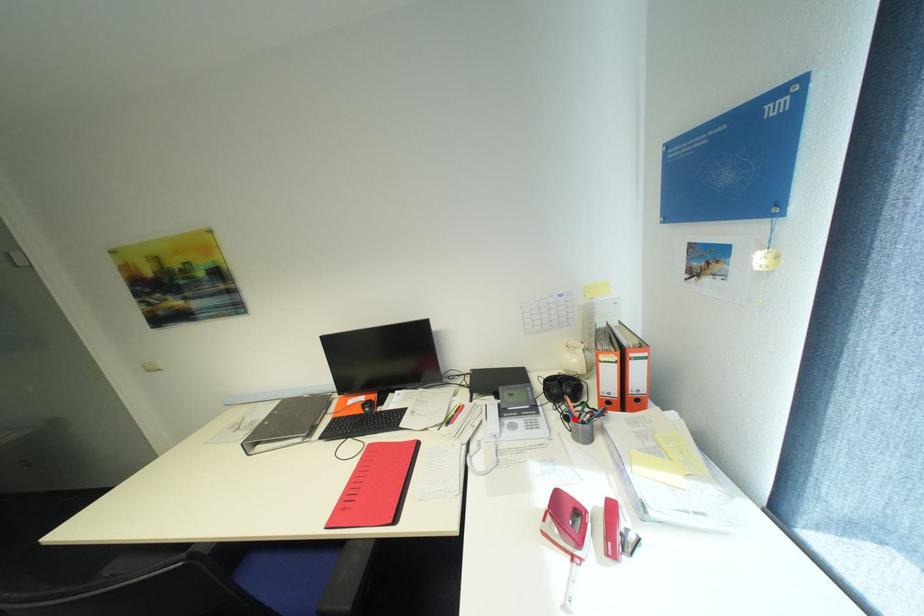
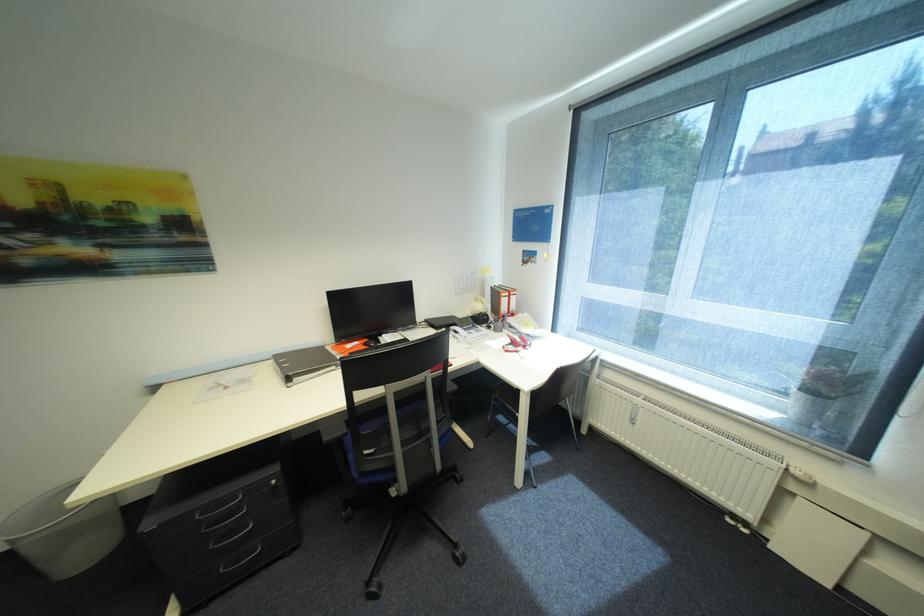
In the second image, find the point that corresponds to the highlighted location in the first image.

(496, 328)